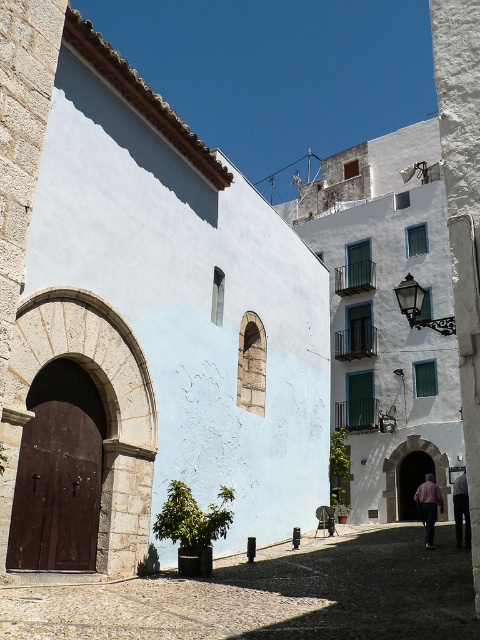
You are an architect designing a new outdoor space. You notice the smooth stone courtyard at center and the pink fabric at lower right in the image. Which of these two elements has a bigger area?

The smooth stone courtyard at center has a larger size compared to the pink fabric at lower right, so the smooth stone courtyard at center has a bigger area.

You are an architect analyzing the street scene. You need to determine which object occupies more horizontal space in the image. Based on the scene, which has a greater width between the smooth stone archway at center and the pink fabric at lower right?

The pink fabric at lower right has a greater width than the smooth stone archway at center according to the description.